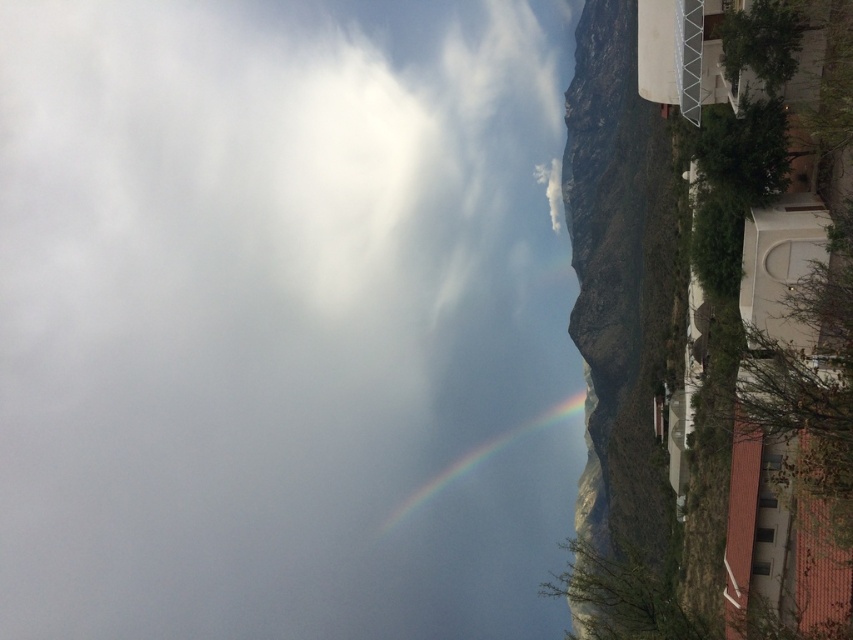
You are an airplane pilot flying through the sky and need to navigate around the white fluffy cloud at upper left and the rainbow at center. Which object requires a wider path to avoid?

The white fluffy cloud at upper left requires a wider path to avoid because its width surpasses that of the rainbow at center.

You are an airplane passenger looking out the window and see the rugged stone mountain at right and the rainbow at center. Which object is positioned higher in the sky?

The rugged stone mountain at right is located above the rainbow at center, so it is positioned higher in the sky.

You are an artist planning to paint the scene. You want to ensure that the rugged stone mountain at right and the rainbow at center are proportionally accurate. Which object should you paint first to maintain proper size relationships?

You should paint the rugged stone mountain at right first because it is larger than the rainbow at center, allowing you to establish the correct size relationship before adding smaller elements.